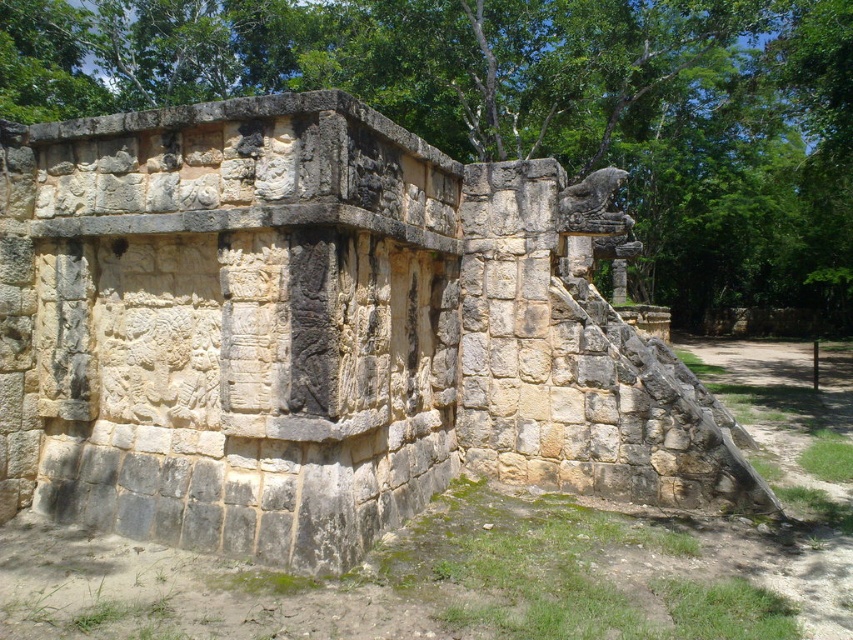
Question: Is natural stone wall at center behind green leafy tree at upper center?

Choices:
 (A) no
 (B) yes

Answer: (A)

Question: Among these objects, which one is farthest from the camera?

Choices:
 (A) green leafy tree at upper center
 (B) natural stone wall at center

Answer: (A)

Question: Is natural stone wall at center bigger than green leafy tree at upper center?

Choices:
 (A) no
 (B) yes

Answer: (A)

Question: Where is natural stone wall at center located in relation to green leafy tree at upper center in the image?

Choices:
 (A) left
 (B) right

Answer: (A)